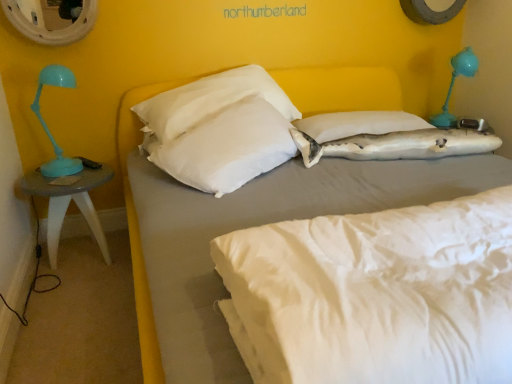
Looking at this image, in order to face matte gray table at left, should I rotate leftwards or rightwards?

To face it directly, rotate left by 23.285 degrees.

The image size is (512, 384). Identify the location of matte gray table at left. (69, 203).

In order to face white fabric mattress at center, should I rotate leftwards or rightwards?

A 25.127 degree turn to the right will do.

You are a GUI agent. You are given a task and a screenshot of the screen. Output one action in this format:
    pyautogui.click(x=<x>, y=<y>)
    Task: Click on the white fabric shark at center, which is the 1th pillow in right-to-left order
    The width and height of the screenshot is (512, 384).
    Given the screenshot: What is the action you would take?
    pyautogui.click(x=398, y=145)

What do you see at coordinates (227, 147) in the screenshot?
I see `white soft pillow at center, the 1th pillow in the left-to-right sequence` at bounding box center [227, 147].

What is the approximate width of white soft pillow at center, which is the third pillow from right to left?

16.81 inches.

This screenshot has width=512, height=384. What are the coordinates of `white fabric pillow at center, the 2th pillow viewed from the right` in the screenshot? It's located at (358, 124).

In the image, is white fabric mattress at center positioned in front of or behind white fabric shark at center, which is the 1th pillow in right-to-left order?

Visually, white fabric mattress at center is located in front of white fabric shark at center, which is the 1th pillow in right-to-left order.

Considering the sizes of objects white fabric mattress at center and white fabric shark at center, marked as the third pillow in a left-to-right arrangement, in the image provided, who is bigger, white fabric mattress at center or white fabric shark at center, marked as the third pillow in a left-to-right arrangement,?

With larger size is white fabric mattress at center.

Measure the distance between white fabric mattress at center and white fabric shark at center, marked as the third pillow in a left-to-right arrangement.

A distance of 97.04 centimeters exists between white fabric mattress at center and white fabric shark at center, marked as the third pillow in a left-to-right arrangement.

Would you say white fabric mattress at center is to the left or to the right of white fabric shark at center, which is the 1th pillow in right-to-left order, in the picture?

In the image, white fabric mattress at center appears on the left side of white fabric shark at center, which is the 1th pillow in right-to-left order.

Is metallic circular mirror at upper left facing towards white fabric shark at center, marked as the third pillow in a left-to-right arrangement?

No, metallic circular mirror at upper left is not oriented towards white fabric shark at center, marked as the third pillow in a left-to-right arrangement.

Is white fabric shark at center, marked as the third pillow in a left-to-right arrangement, located within metallic circular mirror at upper left?

That's incorrect, white fabric shark at center, marked as the third pillow in a left-to-right arrangement, is not inside metallic circular mirror at upper left.

Which object is closer to the camera, metallic circular mirror at upper left or white fabric shark at center, marked as the third pillow in a left-to-right arrangement?

Positioned in front is white fabric shark at center, marked as the third pillow in a left-to-right arrangement.

From a real-world perspective, who is located lower, metallic circular mirror at upper left or white fabric shark at center, marked as the third pillow in a left-to-right arrangement?

In real-world perspective, white fabric shark at center, marked as the third pillow in a left-to-right arrangement, is lower.

Could you measure the distance between white soft pillow at center, which is the third pillow from right to left, and metallic circular mirror at upper left?

white soft pillow at center, which is the third pillow from right to left, is 33.42 inches from metallic circular mirror at upper left.

Which is in front, white soft pillow at center, which is the third pillow from right to left, or metallic circular mirror at upper left?

white soft pillow at center, which is the third pillow from right to left.

Looking at this image, could you tell me if white soft pillow at center, the 1th pillow in the left-to-right sequence, is facing metallic circular mirror at upper left?

No, white soft pillow at center, the 1th pillow in the left-to-right sequence, is not facing towards metallic circular mirror at upper left.

From the image's perspective, which one is positioned higher, white soft pillow at center, which is the third pillow from right to left, or metallic circular mirror at upper left?

metallic circular mirror at upper left, from the image's perspective.

From a real-world perspective, between white fabric shark at center, marked as the third pillow in a left-to-right arrangement, and metallic circular mirror at upper left, who is vertically higher?

From a 3D spatial view, metallic circular mirror at upper left is above.

From the picture: From the image's perspective, is white fabric shark at center, which is the 1th pillow in right-to-left order, below metallic circular mirror at upper left?

Yes, from the image's perspective, white fabric shark at center, which is the 1th pillow in right-to-left order, is beneath metallic circular mirror at upper left.

Is white fabric shark at center, which is the 1th pillow in right-to-left order, turned away from metallic circular mirror at upper left?

No, white fabric shark at center, which is the 1th pillow in right-to-left order, is not facing away from metallic circular mirror at upper left.

Does point (453, 150) lie in front of point (39, 12)?

Yes, point (453, 150) is closer to viewer.

Is matte gray table at left oriented towards white fabric shark at center, marked as the third pillow in a left-to-right arrangement?

No, matte gray table at left is not aimed at white fabric shark at center, marked as the third pillow in a left-to-right arrangement.

From the image's perspective, which object appears higher, matte gray table at left or white fabric shark at center, marked as the third pillow in a left-to-right arrangement?

white fabric shark at center, marked as the third pillow in a left-to-right arrangement, appears higher in the image.

From a real-world perspective, is matte gray table at left over white fabric shark at center, which is the 1th pillow in right-to-left order?

Actually, matte gray table at left is physically below white fabric shark at center, which is the 1th pillow in right-to-left order, in the real world.

Is point (55, 185) less distant than point (454, 148)?

That is False.

From their relative heights in the image, would you say matte gray table at left is taller or shorter than white fabric pillow at center, the 2th pillow viewed from the right?

In the image, matte gray table at left appears to be taller than white fabric pillow at center, the 2th pillow viewed from the right.

Is matte gray table at left to the left or to the right of white fabric pillow at center, which ranks as the 2th pillow in left-to-right order, in the image?

From the image, it's evident that matte gray table at left is to the left of white fabric pillow at center, which ranks as the 2th pillow in left-to-right order.

In the scene shown: Are matte gray table at left and white fabric pillow at center, the 2th pillow viewed from the right, making contact?

No, matte gray table at left is not with white fabric pillow at center, the 2th pillow viewed from the right.

Considering the points (272, 151) and (314, 130), which point is behind, point (272, 151) or point (314, 130)?

The point (314, 130) is behind.

What's the angular difference between white soft pillow at center, the 1th pillow in the left-to-right sequence, and white fabric pillow at center, the 2th pillow viewed from the right,'s facing directions?

There is a 42-degree angle between the facing directions of white soft pillow at center, the 1th pillow in the left-to-right sequence, and white fabric pillow at center, the 2th pillow viewed from the right.

Considering the sizes of objects white soft pillow at center, the 1th pillow in the left-to-right sequence, and white fabric pillow at center, which ranks as the 2th pillow in left-to-right order, in the image provided, who is wider, white soft pillow at center, the 1th pillow in the left-to-right sequence, or white fabric pillow at center, which ranks as the 2th pillow in left-to-right order,?

white fabric pillow at center, which ranks as the 2th pillow in left-to-right order.

Considering the relative sizes of white soft pillow at center, the 1th pillow in the left-to-right sequence, and white fabric pillow at center, which ranks as the 2th pillow in left-to-right order, in the image provided, is white soft pillow at center, the 1th pillow in the left-to-right sequence, shorter than white fabric pillow at center, which ranks as the 2th pillow in left-to-right order,?

Incorrect, the height of white soft pillow at center, the 1th pillow in the left-to-right sequence, does not fall short of that of white fabric pillow at center, which ranks as the 2th pillow in left-to-right order.

This screenshot has height=384, width=512. I want to click on mattress lying below the white fabric shark at center, marked as the third pillow in a left-to-right arrangement (from the image's perspective), so click(375, 294).

Locate an element on the screen. mirror behind the white fabric shark at center, which is the 1th pillow in right-to-left order is located at coordinates (49, 20).

Estimate the real-world distances between objects in this image. Which object is further from matte gray table at left, white fabric shark at center, marked as the third pillow in a left-to-right arrangement, or white matte bed at center?

white matte bed at center is further to matte gray table at left.

In the scene shown: Which object lies further to the anchor point white fabric mattress at center, white fabric pillow at center, the 2th pillow viewed from the right, or white fabric shark at center, which is the 1th pillow in right-to-left order?

white fabric pillow at center, the 2th pillow viewed from the right, lies further to white fabric mattress at center than the other object.

Based on their spatial positions, is white fabric mattress at center or white matte bed at center closer to white soft pillow at center, the 1th pillow in the left-to-right sequence?

white matte bed at center.

Considering their positions, is white fabric shark at center, which is the 1th pillow in right-to-left order, positioned closer to metallic circular mirror at upper left than white soft pillow at center, which is the third pillow from right to left?

white soft pillow at center, which is the third pillow from right to left.

Considering their positions, is white fabric pillow at center, which ranks as the 2th pillow in left-to-right order, positioned closer to matte gray table at left than white matte bed at center?

white fabric pillow at center, which ranks as the 2th pillow in left-to-right order.

Considering their positions, is metallic circular mirror at upper left positioned further to white matte bed at center than white fabric shark at center, which is the 1th pillow in right-to-left order?

metallic circular mirror at upper left.

Which object lies nearer to the anchor point matte gray table at left, white matte bed at center or white fabric mattress at center?

white matte bed at center.

When comparing their distances from white fabric shark at center, marked as the third pillow in a left-to-right arrangement, does metallic circular mirror at upper left or white matte bed at center seem further?

The object further to white fabric shark at center, marked as the third pillow in a left-to-right arrangement, is metallic circular mirror at upper left.

Find the location of `mattress located between white matte bed at center and metallic circular mirror at upper left in the depth direction`. mattress located between white matte bed at center and metallic circular mirror at upper left in the depth direction is located at coordinates (375, 294).

Locate an element on the screen. The height and width of the screenshot is (384, 512). nightstand located between metallic circular mirror at upper left and white fabric shark at center, marked as the third pillow in a left-to-right arrangement, in the left-right direction is located at coordinates click(x=69, y=203).

Identify the location of nightstand located between metallic circular mirror at upper left and white soft pillow at center, which is the third pillow from right to left, in the left-right direction. (69, 203).

In order to click on pillow between white fabric mattress at center and white fabric shark at center, which is the 1th pillow in right-to-left order, in the front-back direction in this screenshot , I will do `click(227, 147)`.